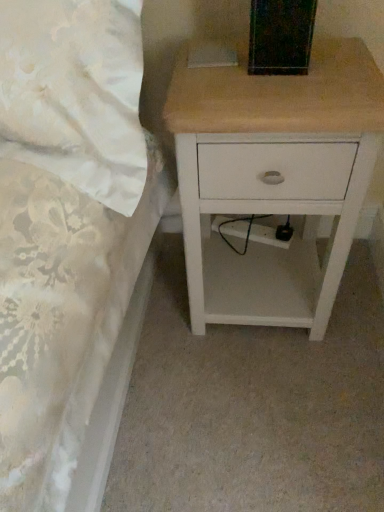
What do you see at coordinates (273, 195) in the screenshot?
I see `white wood nightstand at upper right` at bounding box center [273, 195].

I want to click on white wood nightstand at upper right, so click(x=273, y=195).

Describe the element at coordinates (66, 226) in the screenshot. The width and height of the screenshot is (384, 512). I see `white fabric bed at upper left` at that location.

Where is `white fabric bed at upper left`? This screenshot has width=384, height=512. white fabric bed at upper left is located at coordinates (66, 226).

This screenshot has height=512, width=384. In order to click on white wood nightstand at upper right in this screenshot , I will do `click(273, 195)`.

Which object is positioned more to the right, white fabric bed at upper left or white wood nightstand at upper right?

Positioned to the right is white wood nightstand at upper right.

Which object is closer to the camera taking this photo, white fabric bed at upper left or white wood nightstand at upper right?

white fabric bed at upper left is closer to the camera.

Does point (92, 255) appear closer or farther from the camera than point (361, 102)?

Point (92, 255) is closer to the camera than point (361, 102).

From the image's perspective, between white fabric bed at upper left and white wood nightstand at upper right, who is located below?

white wood nightstand at upper right, from the image's perspective.

From a real-world perspective, does white fabric bed at upper left sit lower than white wood nightstand at upper right?

No.

Does white fabric bed at upper left have a greater width compared to white wood nightstand at upper right?

Incorrect, the width of white fabric bed at upper left does not surpass that of white wood nightstand at upper right.

Is white fabric bed at upper left taller than white wood nightstand at upper right?

No, white fabric bed at upper left is not taller than white wood nightstand at upper right.

Who is smaller, white fabric bed at upper left or white wood nightstand at upper right?

Smaller between the two is white wood nightstand at upper right.

Is white fabric bed at upper left not inside white wood nightstand at upper right?

Yes.

Is white fabric bed at upper left far away from white wood nightstand at upper right?

No, white fabric bed at upper left is not far from white wood nightstand at upper right.

Is white fabric bed at upper left facing towards white wood nightstand at upper right?

No, white fabric bed at upper left is not turned towards white wood nightstand at upper right.

Find the location of a particular element. The height and width of the screenshot is (512, 384). nightstand behind the white fabric bed at upper left is located at coordinates (273, 195).

In the image, is white wood nightstand at upper right on the left side or the right side of white fabric bed at upper left?

white wood nightstand at upper right is positioned on white fabric bed at upper left's right side.

Which object is further away from the camera, white wood nightstand at upper right or white fabric bed at upper left?

white wood nightstand at upper right is more distant.

Does point (184, 180) come behind point (115, 168)?

Yes, point (184, 180) is farther from viewer.

From the image's perspective, is white wood nightstand at upper right below white fabric bed at upper left?

Yes.

From a real-world perspective, is white wood nightstand at upper right positioned above or below white fabric bed at upper left?

In terms of real-world spatial position, white wood nightstand at upper right is below white fabric bed at upper left.

Considering the relative sizes of white wood nightstand at upper right and white fabric bed at upper left in the image provided, is white wood nightstand at upper right thinner than white fabric bed at upper left?

Incorrect, the width of white wood nightstand at upper right is not less than that of white fabric bed at upper left.

Is white wood nightstand at upper right shorter than white fabric bed at upper left?

No.

Considering the sizes of white wood nightstand at upper right and white fabric bed at upper left in the image, is white wood nightstand at upper right bigger or smaller than white fabric bed at upper left?

white wood nightstand at upper right is smaller than white fabric bed at upper left.

Can we say white wood nightstand at upper right lies outside white fabric bed at upper left?

Absolutely, white wood nightstand at upper right is external to white fabric bed at upper left.

Is white wood nightstand at upper right far from white fabric bed at upper left?

No, white wood nightstand at upper right is in close proximity to white fabric bed at upper left.

Consider the image. Is white wood nightstand at upper right looking in the opposite direction of white fabric bed at upper left?

No.

From the picture: Can you tell me how much white wood nightstand at upper right and white fabric bed at upper left differ in facing direction?

0.00126 degrees.

The image size is (384, 512). I want to click on bed on the left side of white wood nightstand at upper right, so click(x=66, y=226).

The width and height of the screenshot is (384, 512). In order to click on bed located in front of the white wood nightstand at upper right in this screenshot , I will do `click(66, 226)`.

What are the coordinates of `bed above the white wood nightstand at upper right (from the image's perspective)` in the screenshot? It's located at [66, 226].